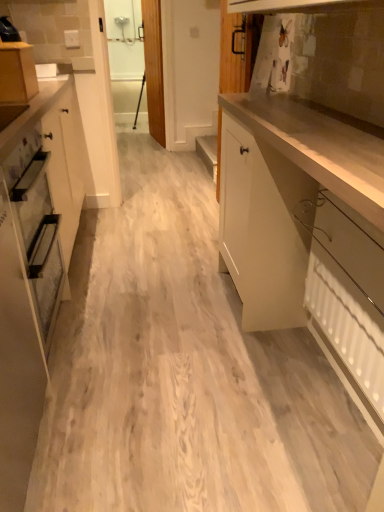
Question: Is white textured radiator at lower right taller or shorter than white glossy cabinet at left, the 2th cabinetry positioned from the right?

Choices:
 (A) tall
 (B) short

Answer: (B)

Question: Considering the relative positions of white textured radiator at lower right and white glossy cabinet at left, the 2th cabinetry when ordered from left to right, in the image provided, is white textured radiator at lower right to the left or to the right of white glossy cabinet at left, the 2th cabinetry when ordered from left to right,?

Choices:
 (A) right
 (B) left

Answer: (A)

Question: Which of these objects is positioned farthest from the matte wood cabinet at upper left, which is counted as the third cabinetry, starting from the right?

Choices:
 (A) white glossy cabinet at left, the 2th cabinetry positioned from the right
 (B) white textured radiator at lower right
 (C) glossy white cabinet at right, which appears as the first cabinetry when viewed from the right

Answer: (B)

Question: Estimate the real-world distances between objects in this image. Which object is farther from the matte wood cabinet at upper left, which appears as the first cabinetry when viewed from the left?

Choices:
 (A) glossy white cabinet at right, the 3th cabinetry positioned from the left
 (B) white glossy cabinet at left, the 2th cabinetry positioned from the right
 (C) white textured radiator at lower right

Answer: (C)